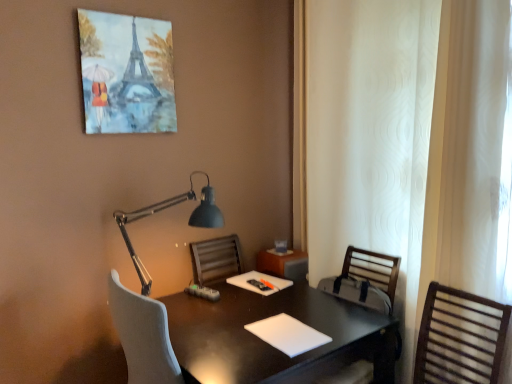
Question: In terms of size, does black glossy desk at center appear bigger or smaller than white matte notepad at center, positioned as the 2th notepad in back-to-front order?

Choices:
 (A) small
 (B) big

Answer: (B)

Question: Is black glossy desk at center inside or outside of white matte notepad at center, the first notepad positioned from the front?

Choices:
 (A) inside
 (B) outside

Answer: (B)

Question: Which object is positioned farthest from the black glossy desk at center?

Choices:
 (A) matte black lamp at upper center
 (B) matte canvas painting of eiffel tower at upper center
 (C) white matte notepad at center, which is the 2th notepad from front to back
 (D) brown wooden chair at right, the 1th chair when ordered from front to back
 (E) white textured curtain at right

Answer: (B)

Question: Which is nearer to the white matte notepad at center, which is the second notepad in top-to-bottom order?

Choices:
 (A) white matte notepad at center, the 1th notepad from the top
 (B) matte black lamp at upper center
 (C) black glossy desk at center
 (D) matte canvas painting of eiffel tower at upper center
 (E) wooden slatted chair at right, placed as the second chair when sorted from front to back

Answer: (C)